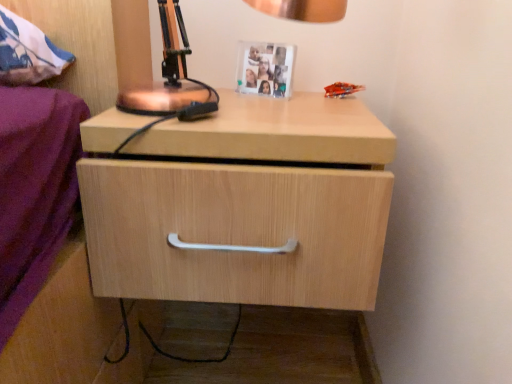
Where is `white plastic picture frame at upper center`? white plastic picture frame at upper center is located at coordinates (265, 68).

Locate an element on the screen. The image size is (512, 384). copper metallic table lamp at upper center is located at coordinates (167, 73).

Is copper metallic table lamp at upper center taller than white plastic picture frame at upper center?

Correct, copper metallic table lamp at upper center is much taller as white plastic picture frame at upper center.

Between point (208, 95) and point (237, 80), which one is positioned in front?

The point (208, 95) is closer.

From the image's perspective, is copper metallic table lamp at upper center on white plastic picture frame at upper center?

No, from the image's perspective, copper metallic table lamp at upper center is not over white plastic picture frame at upper center.

Can we say copper metallic table lamp at upper center lies outside white plastic picture frame at upper center?

→ Yes.

Between copper metallic table lamp at upper center and light wood drawer at center, which one is positioned behind?

Positioned behind is light wood drawer at center.

Between copper metallic table lamp at upper center and light wood drawer at center, which one appears on the right side from the viewer's perspective?

From the viewer's perspective, light wood drawer at center appears more on the right side.

Who is taller, copper metallic table lamp at upper center or light wood drawer at center?

Standing taller between the two is light wood drawer at center.

Which object is positioned more to the right, white plastic picture frame at upper center or copper metallic table lamp at upper center?

white plastic picture frame at upper center is more to the right.

Is there a large distance between white plastic picture frame at upper center and copper metallic table lamp at upper center?

No, there isn't a large distance between white plastic picture frame at upper center and copper metallic table lamp at upper center.

Which of these two, white plastic picture frame at upper center or copper metallic table lamp at upper center, is smaller?

Smaller between the two is white plastic picture frame at upper center.

Does white plastic picture frame at upper center have a lesser width compared to copper metallic table lamp at upper center?

Correct, the width of white plastic picture frame at upper center is less than that of copper metallic table lamp at upper center.

Is point (332, 107) positioned in front of point (250, 85)?

Yes, point (332, 107) is in front of point (250, 85).

Would you say light wood drawer at center is outside white plastic picture frame at upper center?

Absolutely, light wood drawer at center is external to white plastic picture frame at upper center.

From a real-world perspective, who is located higher, light wood drawer at center or white plastic picture frame at upper center?

white plastic picture frame at upper center.

Where is `picture frame that is above the light wood drawer at center (from a real-world perspective)`? picture frame that is above the light wood drawer at center (from a real-world perspective) is located at coordinates (265, 68).

Who is smaller, white plastic picture frame at upper center or light wood drawer at center?

With smaller size is white plastic picture frame at upper center.

Would you say white plastic picture frame at upper center is outside light wood drawer at center?

Yes, white plastic picture frame at upper center is located beyond the bounds of light wood drawer at center.

How different are the orientations of white plastic picture frame at upper center and light wood drawer at center in degrees?

24.9 degrees separate the facing orientations of white plastic picture frame at upper center and light wood drawer at center.

Is light wood drawer at center oriented away from copper metallic table lamp at upper center?

That's not correct — light wood drawer at center is not looking away from copper metallic table lamp at upper center.

Considering the relative sizes of light wood drawer at center and copper metallic table lamp at upper center in the image provided, is light wood drawer at center shorter than copper metallic table lamp at upper center?

In fact, light wood drawer at center may be taller than copper metallic table lamp at upper center.

Who is smaller, light wood drawer at center or copper metallic table lamp at upper center?

copper metallic table lamp at upper center.

Can you tell me how much light wood drawer at center and copper metallic table lamp at upper center differ in facing direction?

light wood drawer at center and copper metallic table lamp at upper center are facing 0.521 degrees away from each other.

At what (x,y) coordinates should I click in order to perform the action: click on table lamp that appears in front of the white plastic picture frame at upper center. Please return your answer as a coordinate pair (x, y). Looking at the image, I should click on (167, 73).

The width and height of the screenshot is (512, 384). What are the coordinates of `the chest of drawers beneath the copper metallic table lamp at upper center (from a real-world perspective)` in the screenshot? It's located at (245, 206).

Looking at the image, which one is located closer to white plastic picture frame at upper center, copper metallic table lamp at upper center or light wood drawer at center?

copper metallic table lamp at upper center is positioned closer to the anchor white plastic picture frame at upper center.

Looking at the image, which one is located closer to light wood drawer at center, white plastic picture frame at upper center or copper metallic table lamp at upper center?

Among the two, copper metallic table lamp at upper center is located nearer to light wood drawer at center.

Which object lies further to the anchor point copper metallic table lamp at upper center, white plastic picture frame at upper center or light wood drawer at center?

Among the two, light wood drawer at center is located further to copper metallic table lamp at upper center.

Looking at this image, which object lies further to the anchor point light wood drawer at center, copper metallic table lamp at upper center or white plastic picture frame at upper center?

Based on the image, white plastic picture frame at upper center appears to be further to light wood drawer at center.

In the scene shown: Which object lies further to the anchor point white plastic picture frame at upper center, light wood drawer at center or copper metallic table lamp at upper center?

light wood drawer at center is further to white plastic picture frame at upper center.

Estimate the real-world distances between objects in this image. Which object is further from copper metallic table lamp at upper center, light wood drawer at center or white plastic picture frame at upper center?

Based on the image, light wood drawer at center appears to be further to copper metallic table lamp at upper center.

Where is `the chest of drawers positioned between copper metallic table lamp at upper center and white plastic picture frame at upper center from near to far`? This screenshot has width=512, height=384. the chest of drawers positioned between copper metallic table lamp at upper center and white plastic picture frame at upper center from near to far is located at coordinates (245, 206).